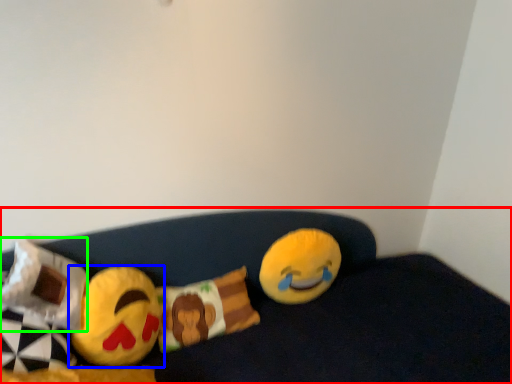
Question: Considering the real-world distances, which object is farthest from furniture (highlighted by a red box)? toy (highlighted by a blue box) or pillow (highlighted by a green box)?

Choices:
 (A) toy
 (B) pillow

Answer: (B)